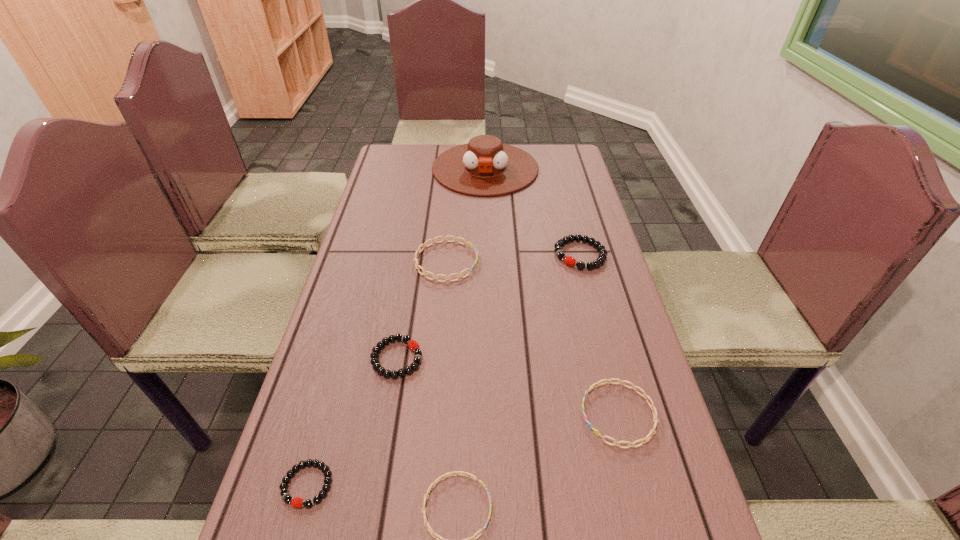
Locate an element on the screen. This screenshot has height=540, width=960. the tallest object is located at coordinates (484, 166).

This screenshot has width=960, height=540. In order to click on cowboy hat in this screenshot , I will do `click(484, 166)`.

I want to click on the biggest blue bracelet, so click(424, 245).

Locate an element on the screen. The width and height of the screenshot is (960, 540). the rightmost black bracelet is located at coordinates (568, 260).

You are a GUI agent. You are given a task and a screenshot of the screen. Output one action in this format:
    pyautogui.click(x=<x>, y=<y>)
    Task: Click on the biggest black bracelet
    
    Given the screenshot: What is the action you would take?
    pyautogui.click(x=568, y=260)

Where is `the rightmost blue bracelet`? the rightmost blue bracelet is located at coordinates (644, 440).

Where is `the fourth farthest bracelet`? the fourth farthest bracelet is located at coordinates (644, 440).

Where is `the second black bracelet from right to left`? The height and width of the screenshot is (540, 960). the second black bracelet from right to left is located at coordinates (412, 344).

I want to click on the fourth nearest object, so pos(412,344).

I want to click on the smallest black bracelet, so click(308, 503).